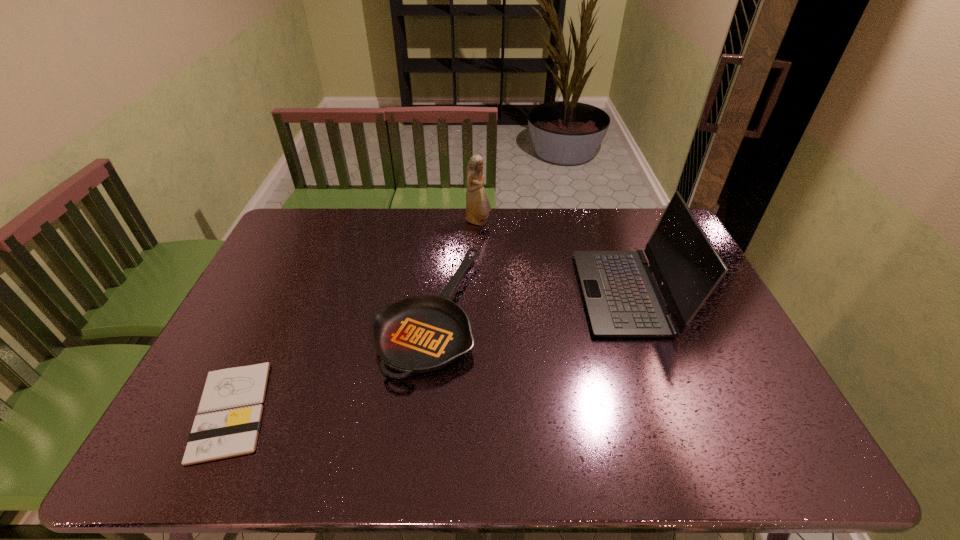
At what (x,y) coordinates should I click in order to perform the action: click on vacant region between the figurine and the leftmost object. Please return your answer as a coordinate pair (x, y). Looking at the image, I should click on (354, 316).

Find the location of `the closest object relative to the farthest object`. the closest object relative to the farthest object is located at coordinates (419, 334).

This screenshot has height=540, width=960. In order to click on object that can be found as the third closest to the leftmost object in this screenshot , I will do `click(622, 298)`.

Identify the location of blank area in the image that satisfies the following two spatial constraints: 1. on the screen of the laptop computer; 2. on the front side of the notepad. This screenshot has height=540, width=960. (670, 410).

Image resolution: width=960 pixels, height=540 pixels. Identify the location of free spot that satisfies the following two spatial constraints: 1. on the front-facing side of the farthest object; 2. on the front side of the notepad. (477, 410).

Where is `vacant space that satisfies the following two spatial constraints: 1. on the screen of the rightmost object; 2. on the front side of the frying pan`? The height and width of the screenshot is (540, 960). vacant space that satisfies the following two spatial constraints: 1. on the screen of the rightmost object; 2. on the front side of the frying pan is located at coordinates (635, 313).

This screenshot has width=960, height=540. Identify the location of vacant position in the image that satisfies the following two spatial constraints: 1. on the front-facing side of the figurine; 2. on the front side of the notepad. (477, 410).